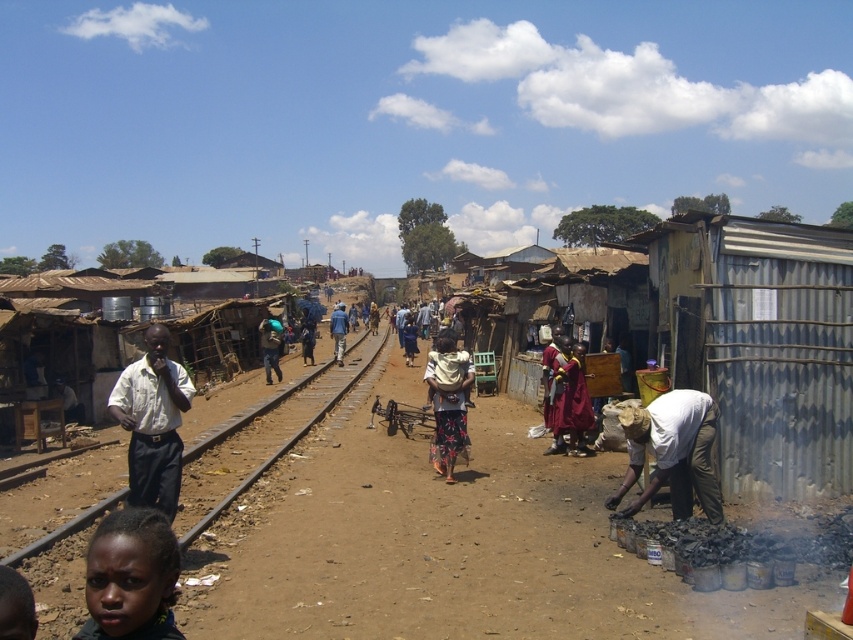
Between dark red fabric at center and dark blue shirt at center, which one is positioned higher?

dark blue shirt at center is above.

Can you confirm if dark red fabric at center is shorter than dark blue shirt at center?

Correct, dark red fabric at center is not as tall as dark blue shirt at center.

Where is `dark red fabric at center`? This screenshot has width=853, height=640. dark red fabric at center is located at coordinates (572, 397).

Who is lower down, white matte shirt at lower right or floral fabric dress at center?

Positioned lower is white matte shirt at lower right.

Who is more distant from viewer, (706, 416) or (434, 388)?

Positioned behind is point (434, 388).

Between point (686, 516) and point (444, 394), which one is positioned in front?

Positioned in front is point (686, 516).

This screenshot has width=853, height=640. I want to click on white matte shirt at lower right, so click(672, 452).

Is dark skin face at lower left above dark blue shirt at center?

Incorrect, dark skin face at lower left is not positioned above dark blue shirt at center.

Is dark skin face at lower left taller than dark blue shirt at center?

In fact, dark skin face at lower left may be shorter than dark blue shirt at center.

Is point (137, 557) positioned after point (341, 332)?

No.

The width and height of the screenshot is (853, 640). I want to click on dark skin face at lower left, so 131,577.